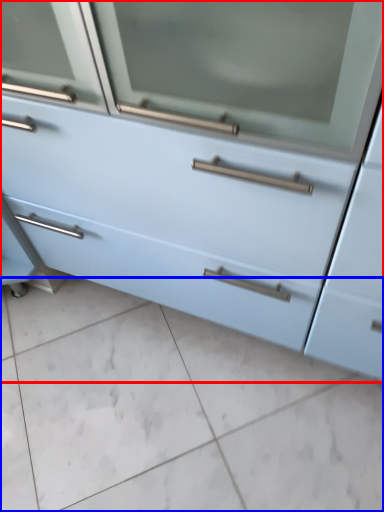
Question: Which point is closer to the camera, chest of drawers (highlighted by a red box) or ceramic tile (highlighted by a blue box)?

Choices:
 (A) chest of drawers
 (B) ceramic tile

Answer: (A)